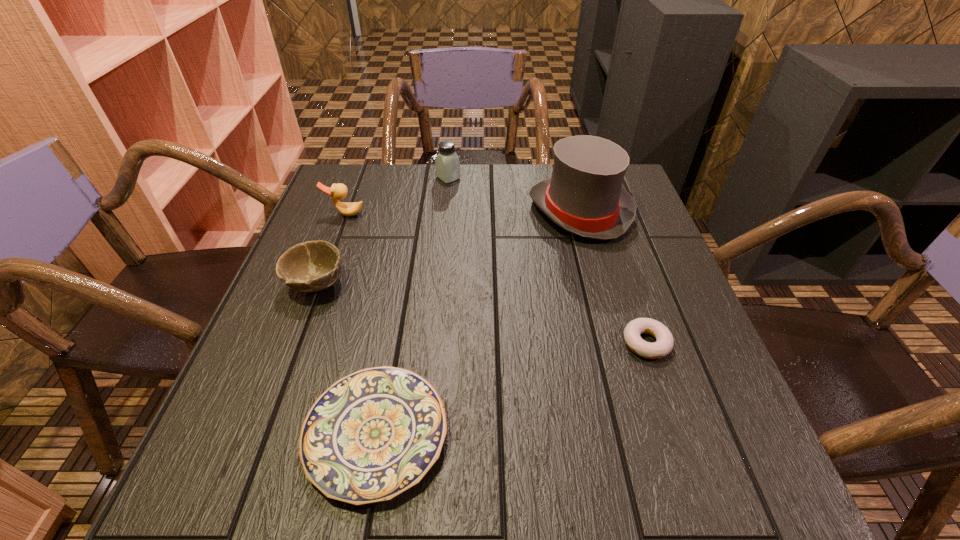
Identify the location of free location at the right edge of the desktop. (698, 351).

Image resolution: width=960 pixels, height=540 pixels. In the image, there is a desktop. What are the coordinates of `free region at the far left corner` in the screenshot? It's located at (348, 184).

Locate an element on the screen. This screenshot has height=540, width=960. vacant space at the near left corner of the desktop is located at coordinates (217, 457).

Locate an element on the screen. The width and height of the screenshot is (960, 540). free space between the plate and the saltshaker is located at coordinates (413, 306).

The height and width of the screenshot is (540, 960). I want to click on empty location between the tallest object and the duck, so click(x=463, y=212).

At what (x,y) coordinates should I click in order to perform the action: click on blank region between the nearest object and the fourth farthest object. Please return your answer as a coordinate pair (x, y). The image size is (960, 540). Looking at the image, I should click on (347, 359).

Identify the location of free space between the tallest object and the shortest object. This screenshot has width=960, height=540. (478, 322).

The image size is (960, 540). In order to click on vacant area between the second nearest object and the third nearest object in this screenshot , I will do [481, 314].

The width and height of the screenshot is (960, 540). What are the coordinates of `vacant area that lies between the plate and the bowl` in the screenshot? It's located at (347, 359).

Identify the location of free space that is in between the duck and the dress hat. The image size is (960, 540). (463, 212).